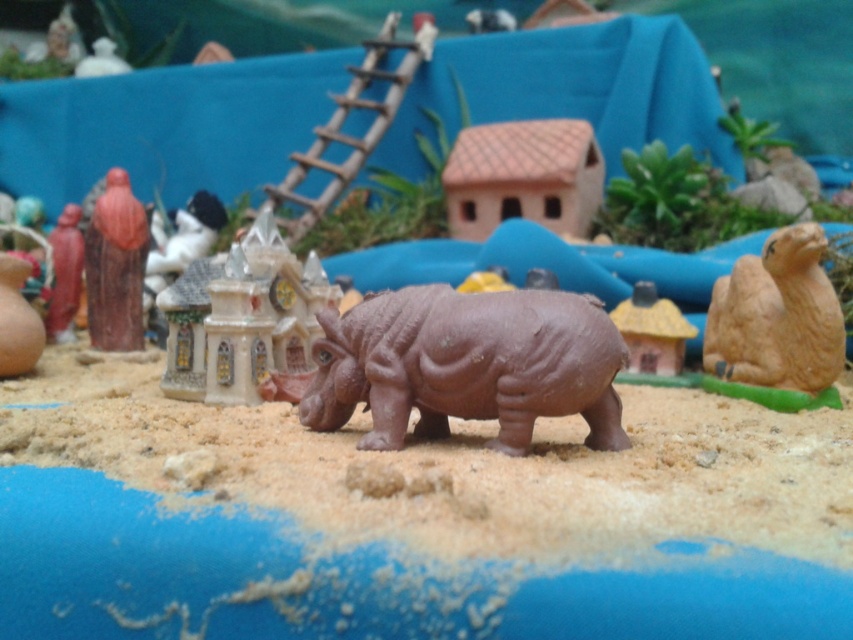
Does brown matte rhinoceros at center have a lesser width compared to brown matte house at center?

In fact, brown matte rhinoceros at center might be wider than brown matte house at center.

Is brown matte rhinoceros at center further to the viewer compared to brown matte house at center?

That is False.

Which is in front, point (486, 352) or point (668, 372)?

Point (486, 352)

What are the coordinates of `brown matte rhinoceros at center` in the screenshot? It's located at (467, 365).

Which is behind, point (688, 456) or point (666, 307)?

The point (666, 307) is behind.

Which is more to the right, brown matte sand at center or brown matte house at center?

From the viewer's perspective, brown matte house at center appears more on the right side.

Identify the location of brown matte sand at center. (459, 467).

Which is behind, point (743, 264) or point (679, 348)?

Point (679, 348)

Does brown matte camel at right lie in front of brown matte house at center?

That is True.

Does point (834, 326) come in front of point (642, 337)?

Yes, it is in front of point (642, 337).

Locate an element on the screen. brown matte camel at right is located at coordinates (776, 316).